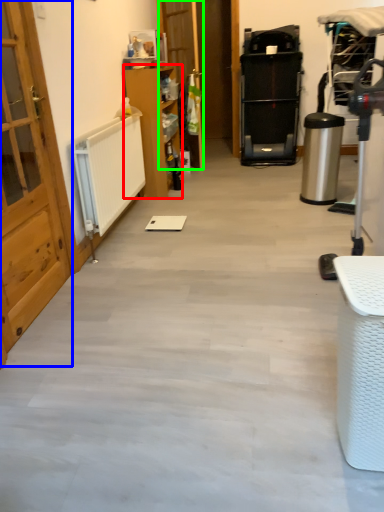
Question: Estimate the real-world distances between objects in this image. Which object is farther from furniture (highlighted by a red box), door (highlighted by a blue box) or door (highlighted by a green box)?

Choices:
 (A) door
 (B) door

Answer: (A)